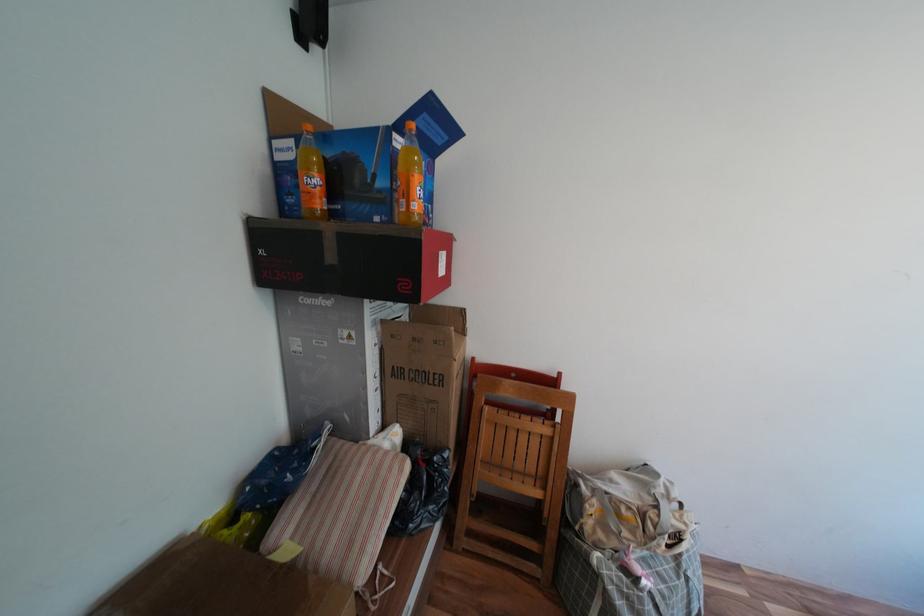
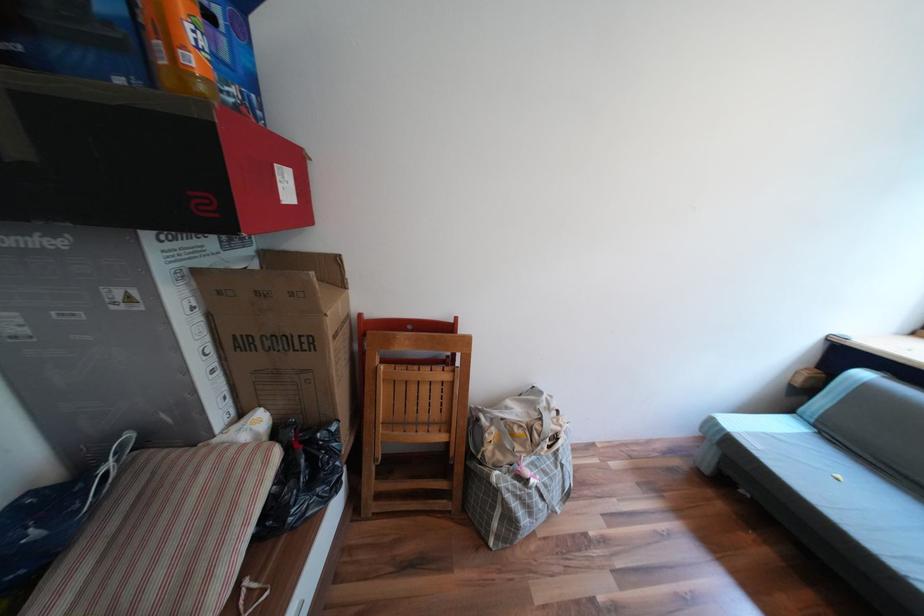
Where in the second image is the point corresponding to [596,506] from the first image?

(495, 435)